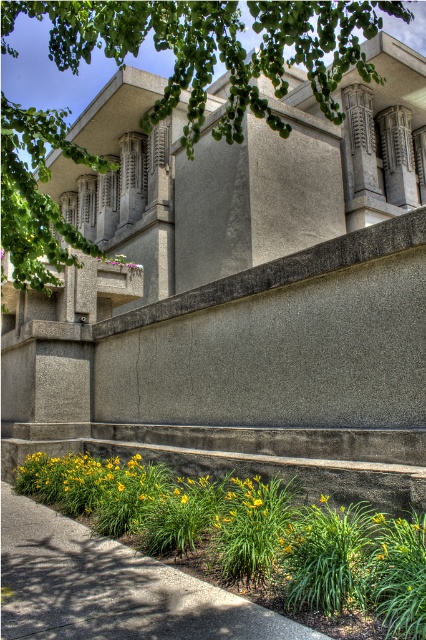
Which is in front, point (270, 109) or point (115, 253)?

Point (270, 109) is more forward.

Does green leafy tree at upper center come behind purple matte flower at upper center?

No, it is in front of purple matte flower at upper center.

Image resolution: width=426 pixels, height=640 pixels. In order to click on green leafy tree at upper center in this screenshot , I will do `click(215, 49)`.

The height and width of the screenshot is (640, 426). Find the location of `green leafy tree at upper center`. green leafy tree at upper center is located at coordinates (215, 49).

Is green grass at lower left positioned behind purple matte flower at upper center?

That is False.

Where is `green grass at lower left`? This screenshot has width=426, height=640. green grass at lower left is located at coordinates (112, 588).

Where is `green grass at lower left`? green grass at lower left is located at coordinates (112, 588).

Can you confirm if green leafy tree at upper center is bigger than green grass at lower left?

Correct, green leafy tree at upper center is larger in size than green grass at lower left.

Is green leafy tree at upper center to the right of green grass at lower left from the viewer's perspective?

Correct, you'll find green leafy tree at upper center to the right of green grass at lower left.

Is point (204, 83) positioned after point (6, 634)?

Yes, it is behind point (6, 634).

Find the location of `green leafy tree at upper center`. green leafy tree at upper center is located at coordinates (215, 49).